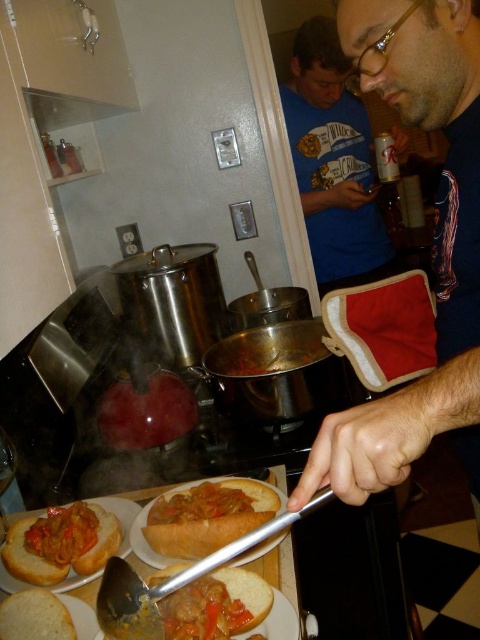
Question: Is matte black oven mitt at center bigger than meat with tomato sauce at center?

Choices:
 (A) no
 (B) yes

Answer: (B)

Question: Which object appears closest to the camera in this image?

Choices:
 (A) matte blue shirt at upper center
 (B) matte black oven mitt at center

Answer: (B)

Question: Can you confirm if meat with tomato sauce at center is positioned below white bread at lower left?

Choices:
 (A) yes
 (B) no

Answer: (B)

Question: Which point is closer to the camera?

Choices:
 (A) meat with tomato sauce at center
 (B) matte black oven mitt at center
 (C) white bread at lower left

Answer: (B)

Question: In this image, where is golden brown bread at lower left located relative to white bread at lower left?

Choices:
 (A) left
 (B) right

Answer: (A)

Question: Which of the following is the closest to the observer?

Choices:
 (A) (313, 268)
 (B) (17, 621)
 (C) (118, 560)

Answer: (C)